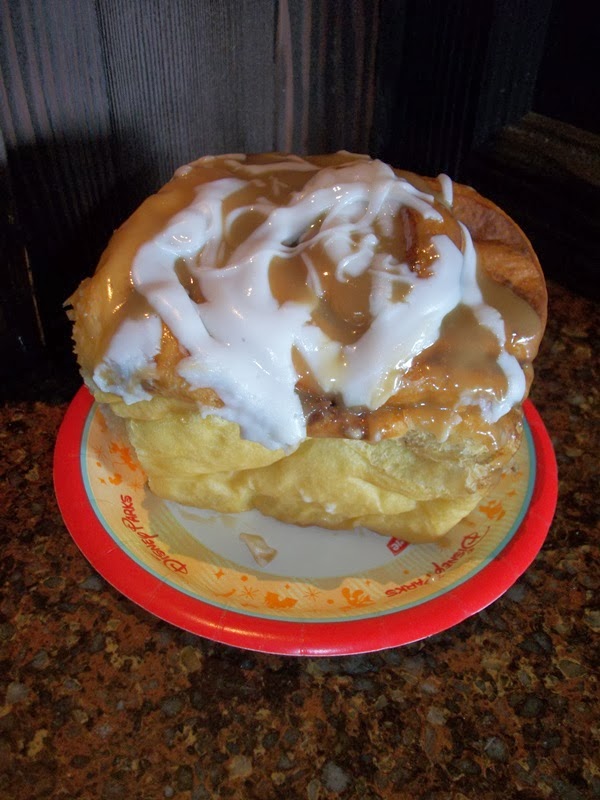
Where is `dark brown wood wall`? The image size is (600, 800). dark brown wood wall is located at coordinates (223, 84).